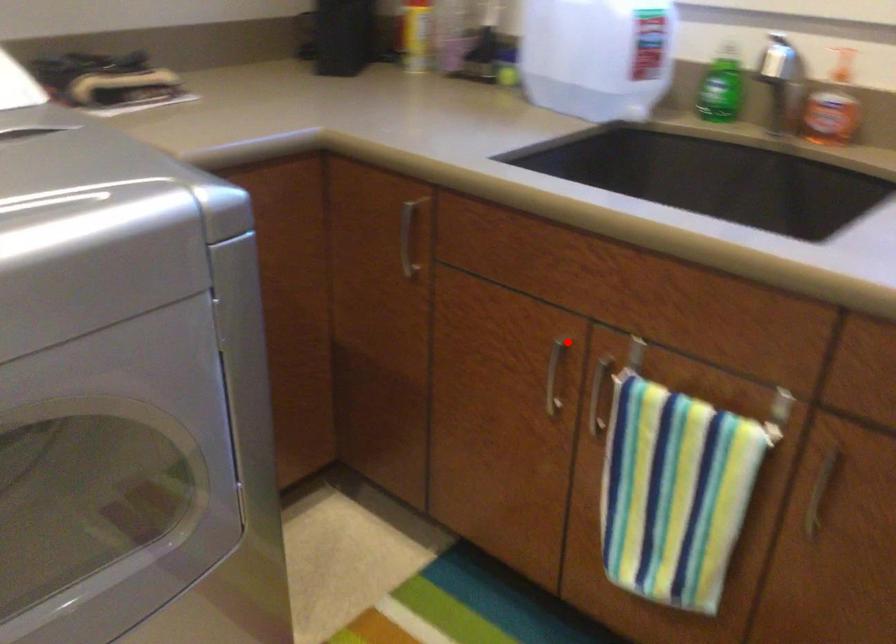
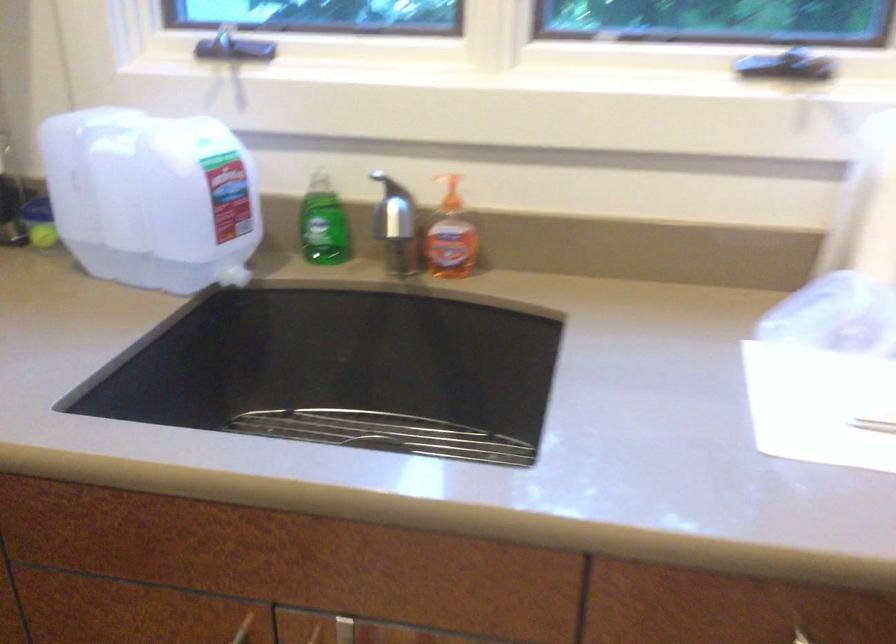
Where in the second image is the point corresponding to the highlighted location from the first image?

(243, 629)